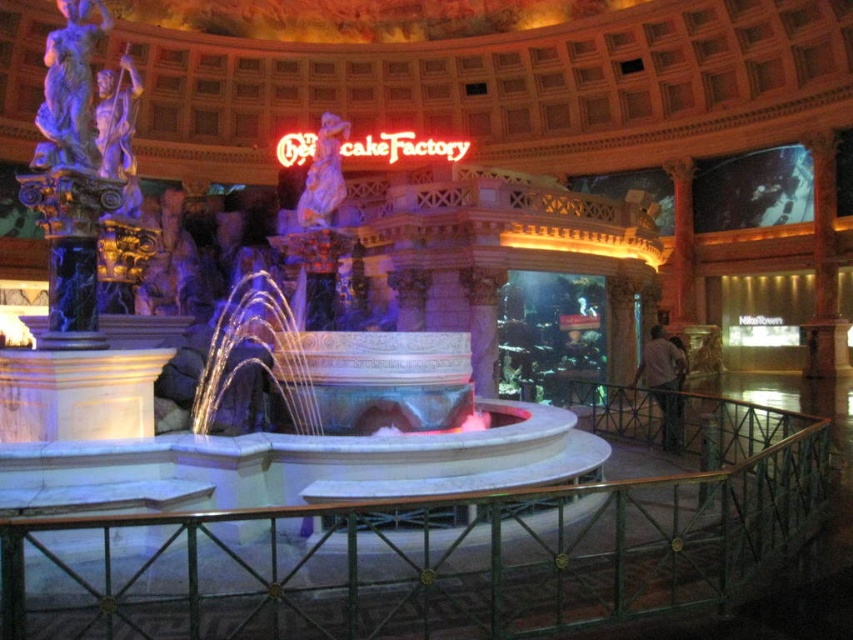
Question: Does green metal railing at center have a larger size compared to neontexturedsign at center?

Choices:
 (A) no
 (B) yes

Answer: (A)

Question: Which of the following is the closest to the observer?

Choices:
 (A) (267, 572)
 (B) (375, 138)

Answer: (A)

Question: Can you confirm if green metal railing at center is positioned below neontexturedsign at center?

Choices:
 (A) no
 (B) yes

Answer: (B)

Question: Which point appears closest to the camera in this image?

Choices:
 (A) 209,632
 (B) 370,156

Answer: (A)

Question: Does green metal railing at center have a smaller size compared to neontexturedsign at center?

Choices:
 (A) no
 (B) yes

Answer: (B)

Question: Which object appears closest to the camera in this image?

Choices:
 (A) neontexturedsign at center
 (B) green metal railing at center

Answer: (B)